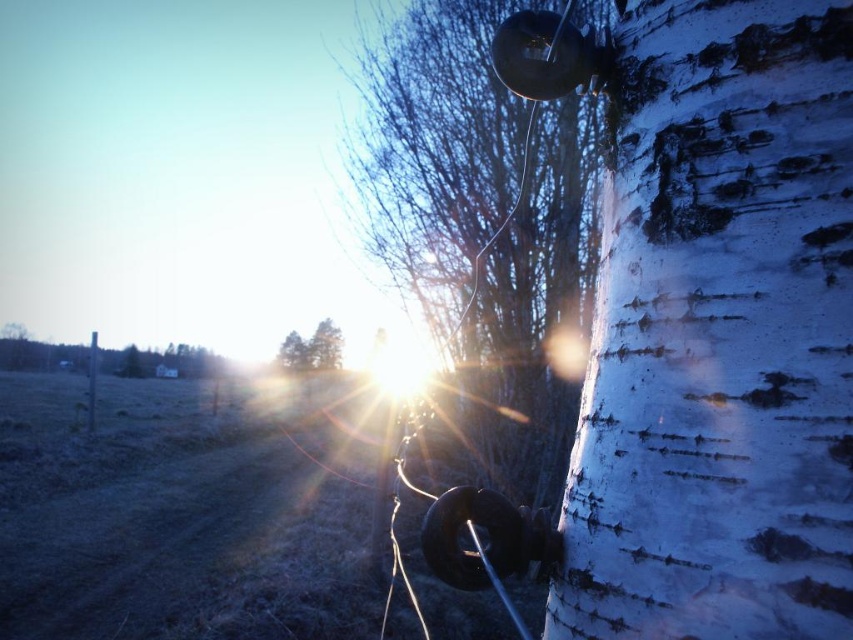
Question: Which point is farther from the camera taking this photo?

Choices:
 (A) (648, 51)
 (B) (323, 353)
 (C) (397, 252)
 (D) (91, 374)

Answer: (B)

Question: Can you confirm if white textured bark at upper right is positioned above smooth gray pole at center?

Choices:
 (A) yes
 (B) no

Answer: (A)

Question: Which object is closer to the camera taking this photo?

Choices:
 (A) smooth gray pole at center
 (B) brown wood trees at center
 (C) white textured bark at upper right

Answer: (C)

Question: Which point is closer to the camera?

Choices:
 (A) (294, 332)
 (B) (90, 349)

Answer: (A)

Question: Does white textured bark at right have a smaller size compared to brown wood trees at center?

Choices:
 (A) yes
 (B) no

Answer: (A)

Question: Is white textured bark at upper right to the left of brown wood trees at center from the viewer's perspective?

Choices:
 (A) no
 (B) yes

Answer: (A)